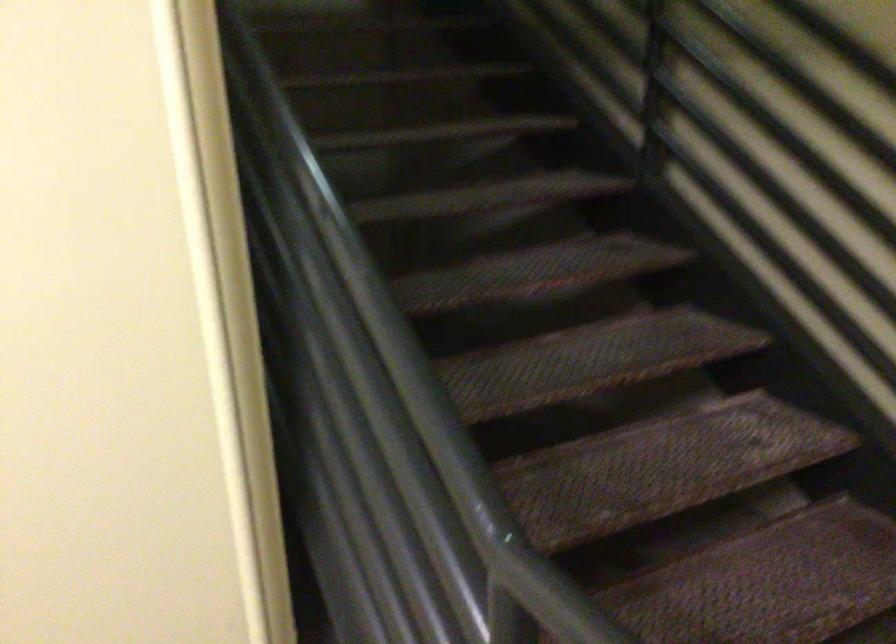
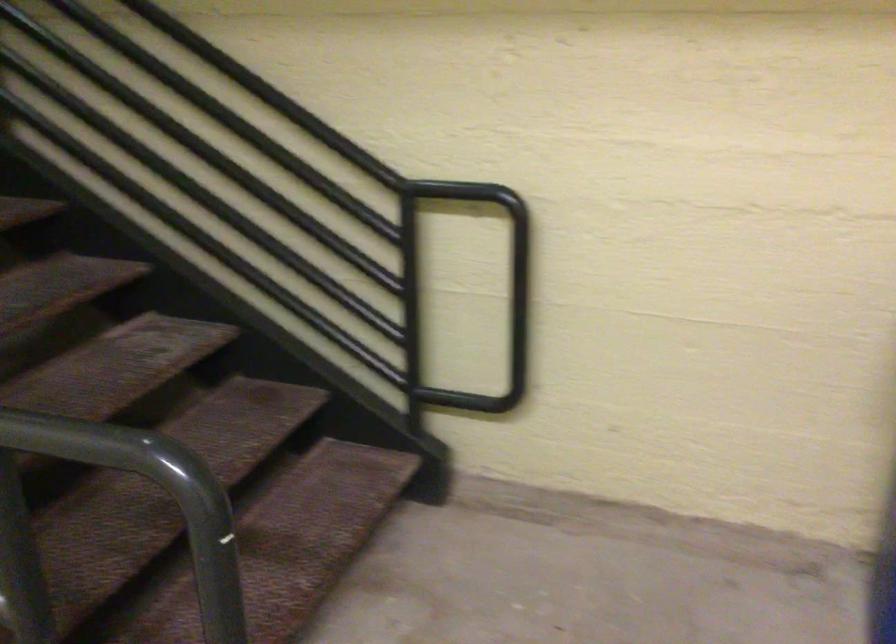
Question: The images are taken continuously from a first-person perspective. In which direction is your viewpoint rotating?

Choices:
 (A) Left
 (B) Right
 (C) Up
 (D) Down

Answer: (B)